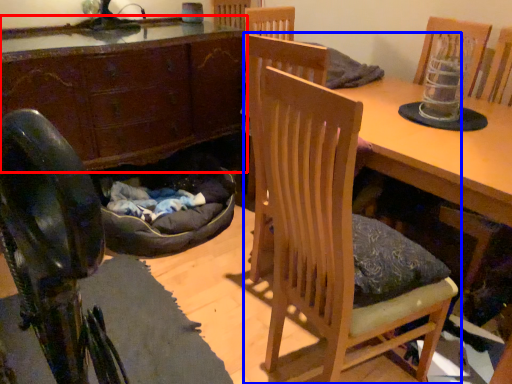
Question: Which point is further to the camera, cabinetry (highlighted by a red box) or chair (highlighted by a blue box)?

Choices:
 (A) cabinetry
 (B) chair

Answer: (A)